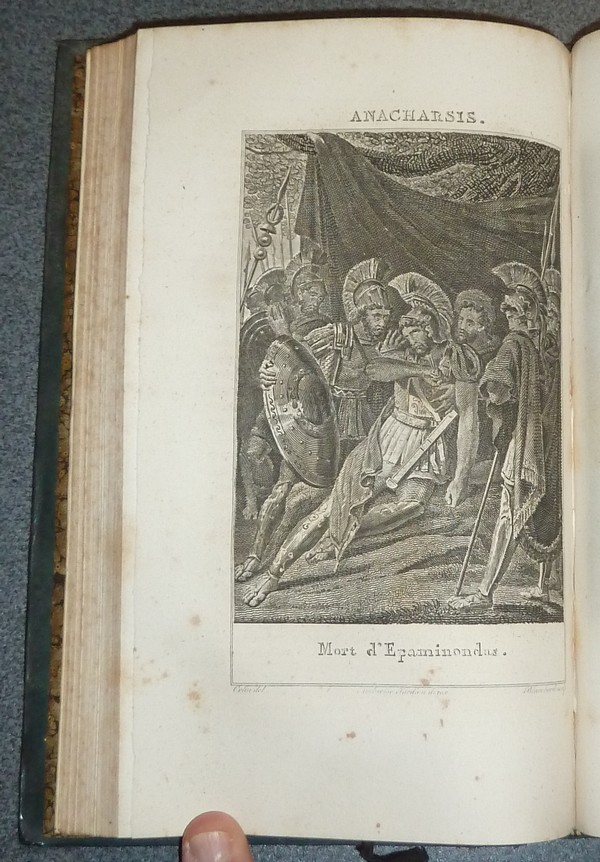
I want to click on cover, so click(x=56, y=157).